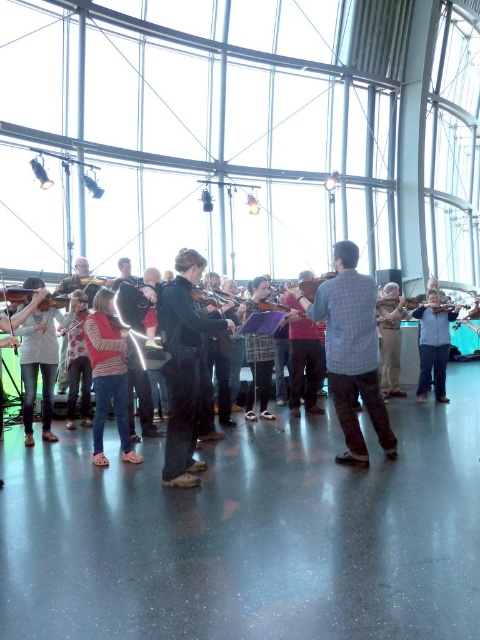
You are a photographer setting up for a group photo. You need to ensure that the checkered fabric shirt at center and the light blue denim jeans at center are both visible in the frame. Given their widths, which one might require more careful positioning to avoid being cut off?

The light blue denim jeans at center has a greater width compared to the checkered fabric shirt at center, so it might require more careful positioning to avoid being cut off.

You are a photographer setting up a shoot in the room. You need to position a 1.5m tall tripod between the black leather jacket at center and the light blue denim jeans at center. Can the tripod fit vertically between them without exceeding their height?

The black leather jacket at center is not as tall as light blue denim jeans at center. Since the light blue denim jeans at center is taller than the black leather jacket at center, but the height of the jeans isn not specified, we can not determine if the tripod will fit. However, if the light blue denim jeans at center is taller than 1.5 meters, the tripod can fit. Otherwise, it might not. Without exact measurements, it is uncertain.

You are a photographer trying to capture a closeup of the checkered fabric shirt at center and light blue denim jeans at center. Since you want both items to appear similarly sized in the photo, which object should you move closer to the camera?

The checkered fabric shirt at center has a smaller size compared to light blue denim jeans at center, so you should move the checkered fabric shirt at center closer to the camera to make it appear the same size as the light blue denim jeans at center in the photo.